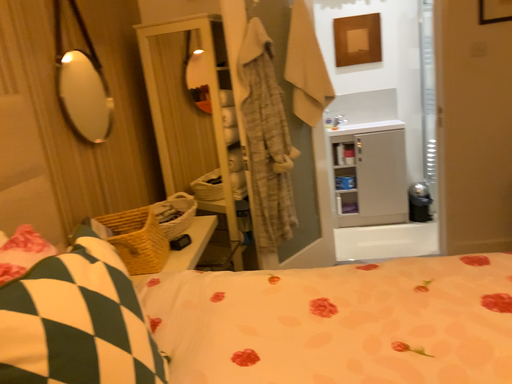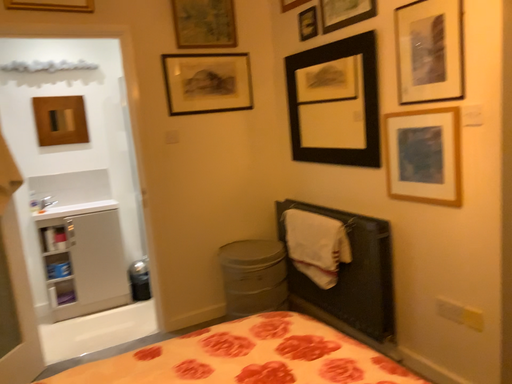
Question: Which way did the camera rotate in the video?

Choices:
 (A) rotated left
 (B) rotated right

Answer: (B)